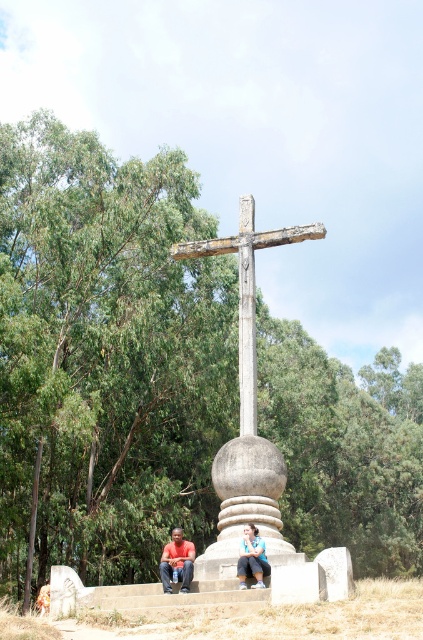
Does weathered wood cross at center have a smaller size compared to matte black clothing at center?

No.

Who is positioned more to the left, weathered wood cross at center or matte black clothing at center?

matte black clothing at center is more to the left.

Is point (318, 227) closer to camera compared to point (178, 538)?

No, it is not.

Where is `weathered wood cross at center`? weathered wood cross at center is located at coordinates (247, 289).

Between point (246, 301) and point (162, 580), which one is positioned in front?

Point (162, 580)

This screenshot has height=640, width=423. Find the location of `weathered wood cross at center`. weathered wood cross at center is located at coordinates (247, 289).

The height and width of the screenshot is (640, 423). Identify the location of weathered wood cross at center. 247,289.

Is weathered wood cross at center to the right of blue denim jeans at lower center from the viewer's perspective?

Incorrect, weathered wood cross at center is not on the right side of blue denim jeans at lower center.

Does weathered wood cross at center have a greater height compared to blue denim jeans at lower center?

Yes.

At what (x,y) coordinates should I click in order to perform the action: click on weathered wood cross at center. Please return your answer as a coordinate pair (x, y). The width and height of the screenshot is (423, 640). Looking at the image, I should click on (247, 289).